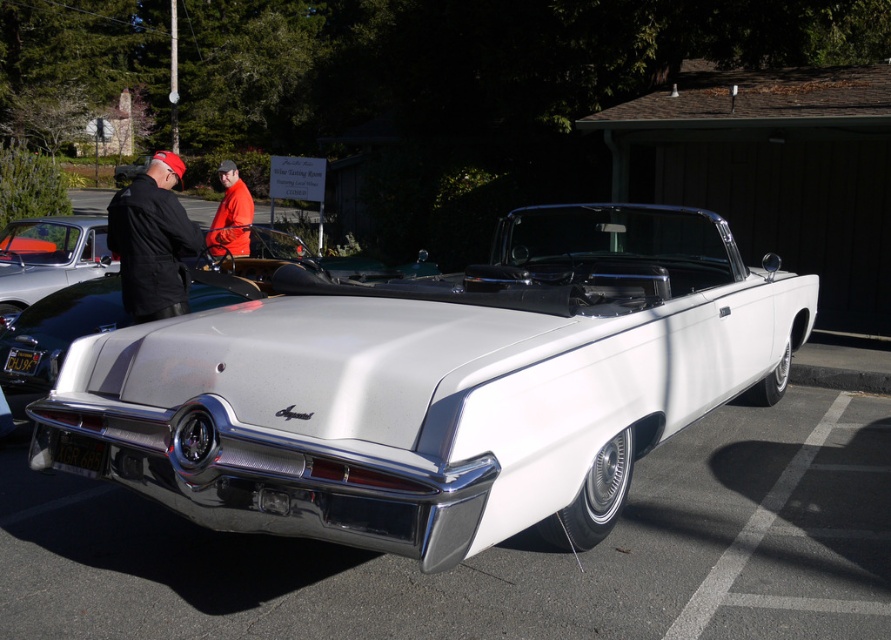
Is white glossy car at center closer to camera compared to black leather jacket at left?

Yes, it is in front of black leather jacket at left.

In the scene shown: Measure the distance between white glossy car at center and black leather jacket at left.

white glossy car at center is 11.42 feet away from black leather jacket at left.

This screenshot has width=891, height=640. In order to click on white glossy car at center in this screenshot , I will do `click(497, 552)`.

At what (x,y) coordinates should I click in order to perform the action: click on white glossy car at center. Please return your answer as a coordinate pair (x, y). This screenshot has width=891, height=640. Looking at the image, I should click on (497, 552).

From the picture: Is black leather jacket at left above orange fabric jacket at center?

Actually, black leather jacket at left is below orange fabric jacket at center.

The image size is (891, 640). What do you see at coordinates (152, 241) in the screenshot?
I see `black leather jacket at left` at bounding box center [152, 241].

This screenshot has height=640, width=891. I want to click on black leather jacket at left, so click(x=152, y=241).

I want to click on black leather jacket at left, so click(x=152, y=241).

Which is above, black leather jacket at left or shiny silver car at center?

black leather jacket at left is above.

Is black leather jacket at left smaller than shiny silver car at center?

Incorrect, black leather jacket at left is not smaller in size than shiny silver car at center.

In order to click on black leather jacket at left in this screenshot , I will do `click(152, 241)`.

At what (x,y) coordinates should I click in order to perform the action: click on black leather jacket at left. Please return your answer as a coordinate pair (x, y). Looking at the image, I should click on (152, 241).